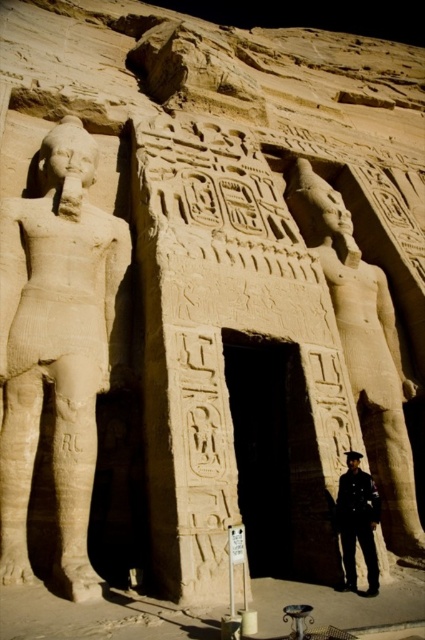
You are an archaeologist examining the entrance of the ancient Egyptian temple. You notice a specific point marked at coordinates point (57,348). Which statue does this point belong to?

The point (57,348) is on the beige stone statue at left.

You are an archaeologist examining the entrance of an ancient Egyptian temple. You notice two statues near the entrance. The beige stone statue at left and the polished stone statue at center. Which statue is shorter?

The beige stone statue at left is not as tall as the polished stone statue at center, so the beige stone statue at left is shorter.

You are an archaeologist standing in front of the temple entrance. You notice a polished stone statue at center and a dark blue uniform at center. Which object is positioned to the right of the other?

The polished stone statue at center is to the right of the dark blue uniform at center.